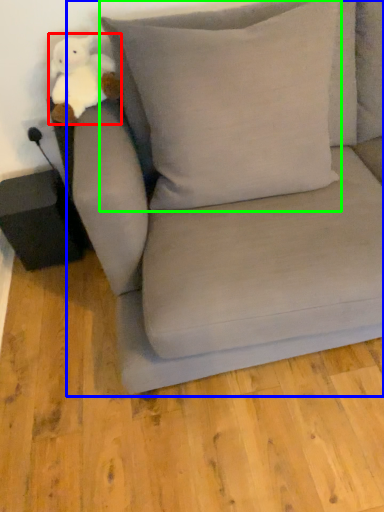
Question: Which object is the closest to the toy (highlighted by a red box)? Choose among these: studio couch (highlighted by a blue box) or pillow (highlighted by a green box).

Choices:
 (A) studio couch
 (B) pillow

Answer: (B)